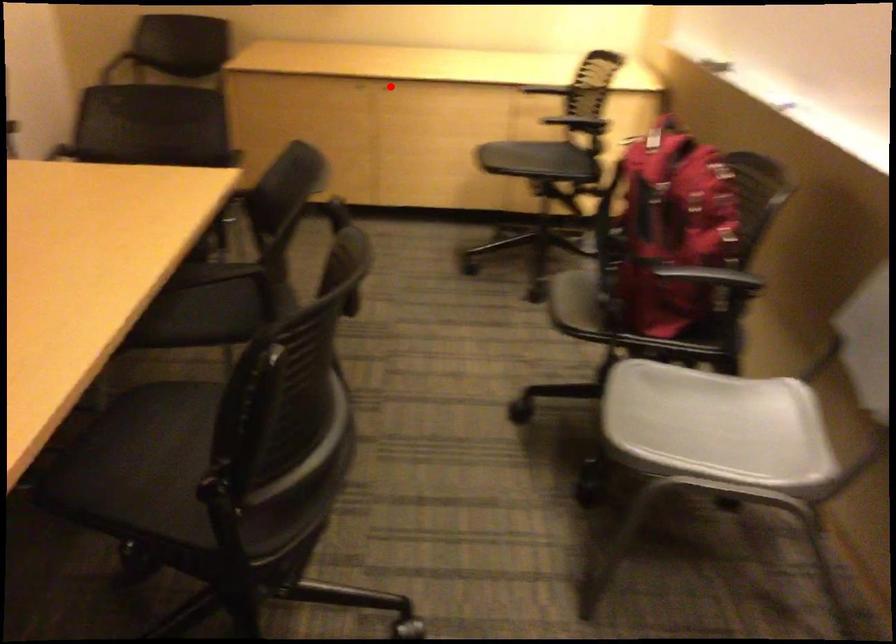
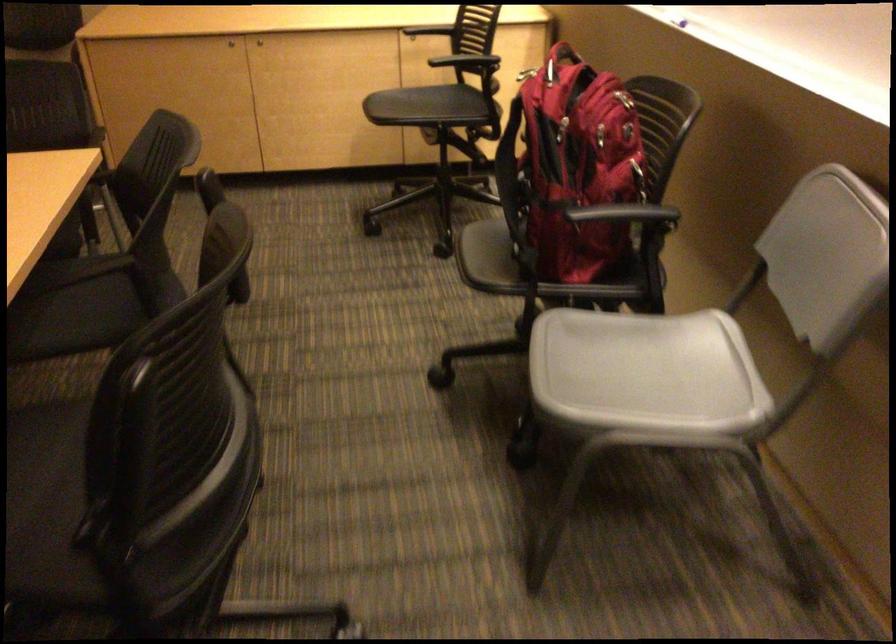
Find the pixel in the second image that matches the highlighted location in the first image.

(259, 41)